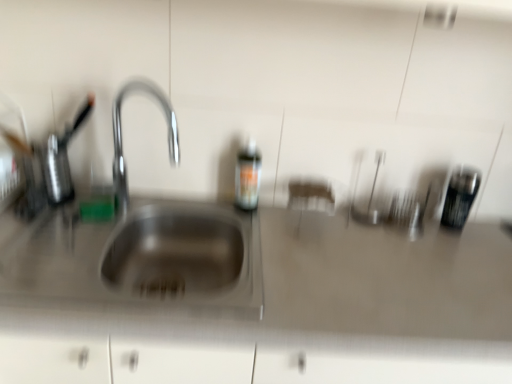
Where is `vacant region to the left of metallic black canister at right`? This screenshot has height=384, width=512. vacant region to the left of metallic black canister at right is located at coordinates (415, 234).